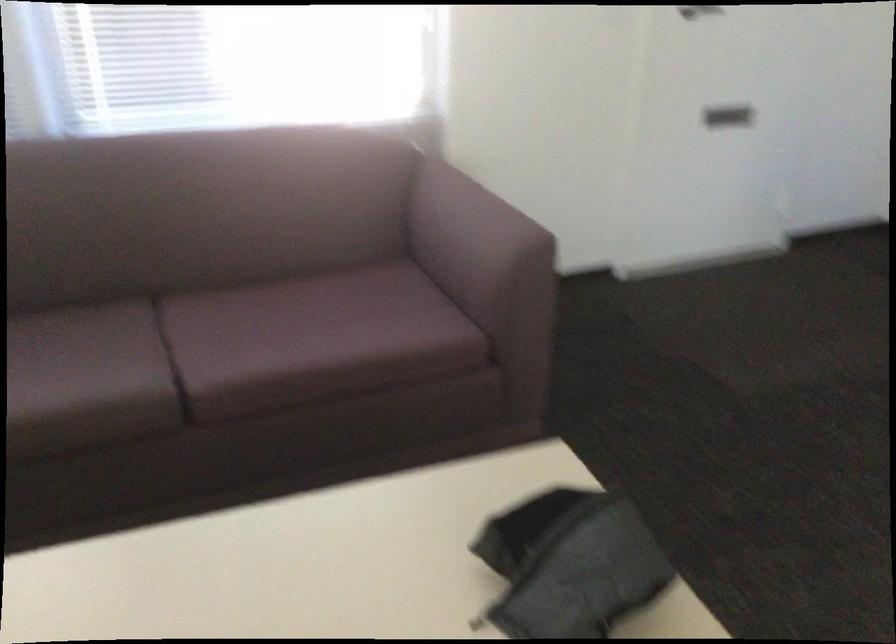
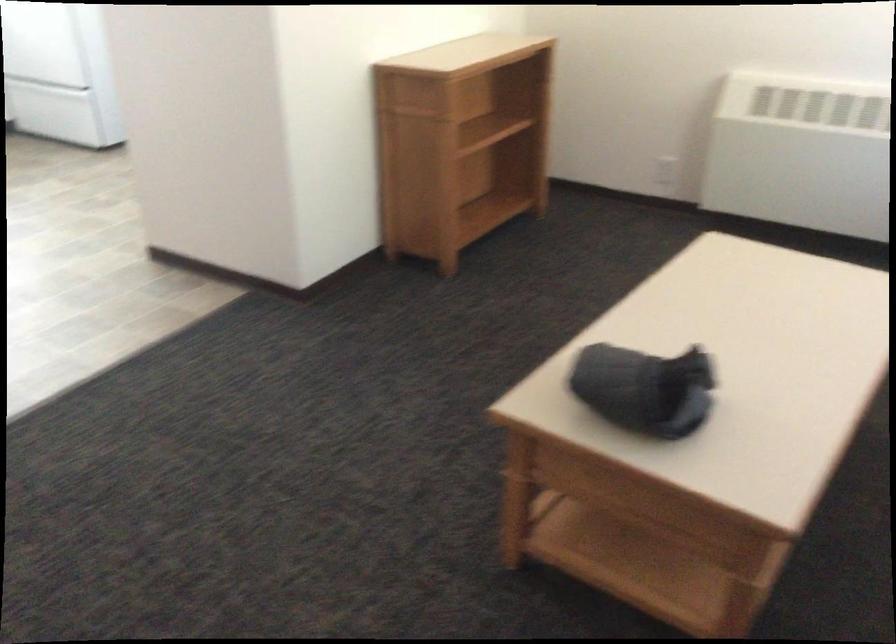
Locate, in the second image, the point that corresponds to point (586, 527) in the first image.

(644, 389)